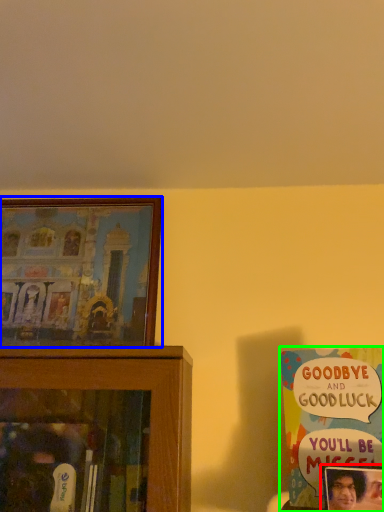
Question: Which is farther away from picture frame (highlighted by a red box)? picture frame (highlighted by a blue box) or book (highlighted by a green box)?

Choices:
 (A) picture frame
 (B) book

Answer: (A)